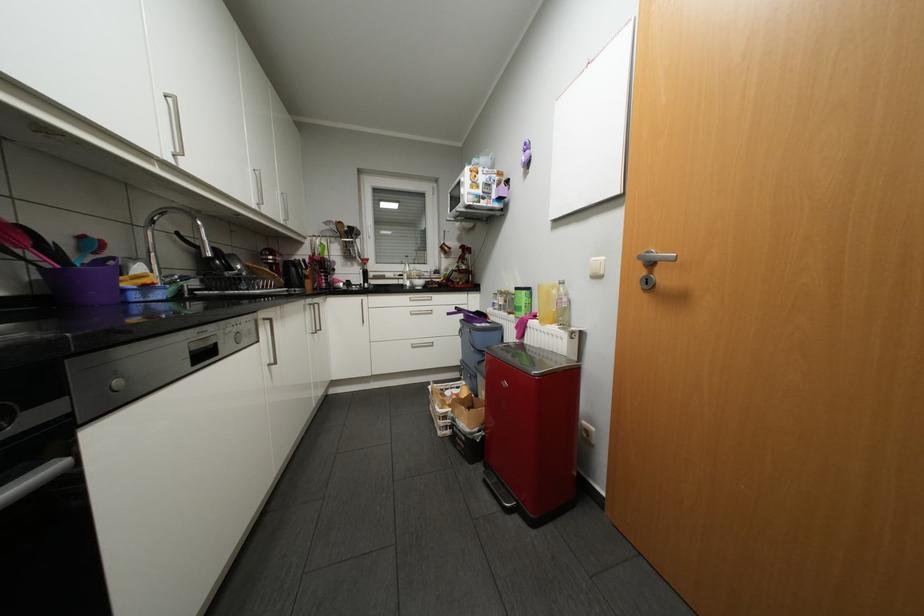
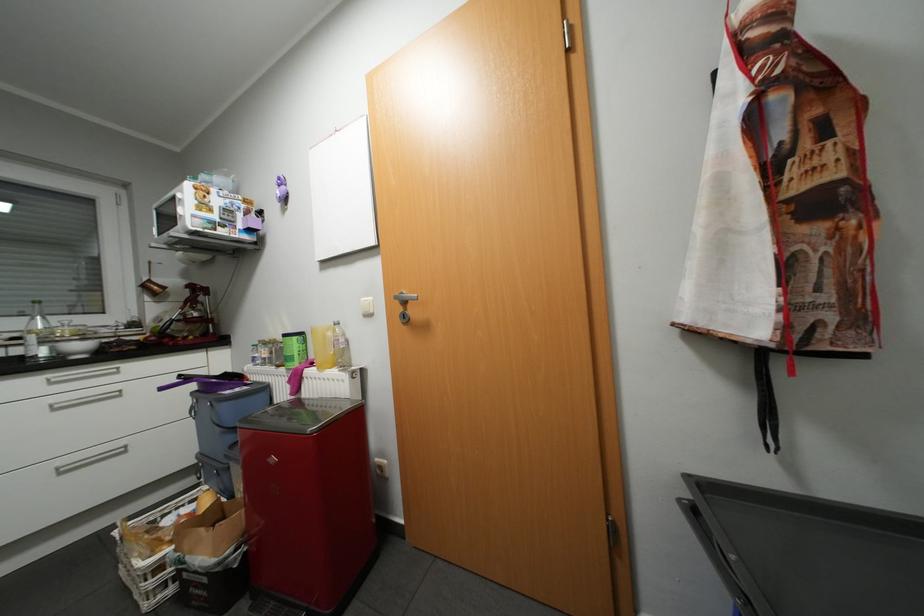
Find the pixel in the second image that matches (x=409, y=284) in the first image.

(30, 357)